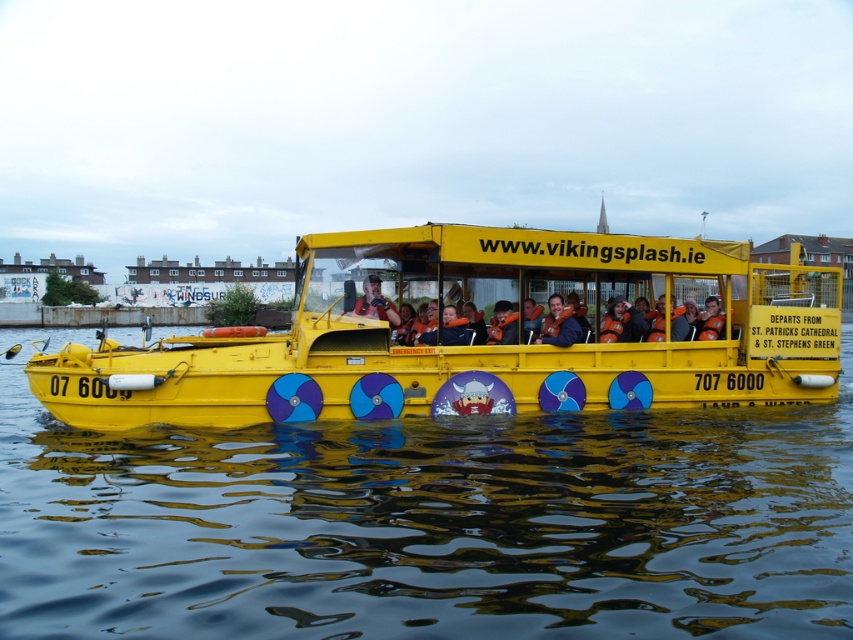
Is matte black helmet at center bigger than orange life vest at center?

Correct, matte black helmet at center is larger in size than orange life vest at center.

Is point (358, 307) positioned after point (494, 308)?

No, (358, 307) is in front of (494, 308).

Locate an element on the screen. Image resolution: width=853 pixels, height=640 pixels. matte black helmet at center is located at coordinates (375, 301).

Locate an element on the screen. The image size is (853, 640). matte black helmet at center is located at coordinates (375, 301).

Consider the image. Who is more distant from viewer, (618, 298) or (363, 301)?

Point (618, 298)

Measure the distance between point (688, 326) and camera.

Point (688, 326) is 13.51 meters away from camera.

Between point (375, 301) and point (390, 321), which one is positioned behind?

Positioned behind is point (390, 321).

The width and height of the screenshot is (853, 640). I want to click on matte orange life vest at center, so click(x=669, y=323).

Based on the photo, can you confirm if matte orange life vest at center is positioned above matte black life vest at center?

Indeed, matte orange life vest at center is positioned over matte black life vest at center.

In the scene shown: Does matte orange life vest at center appear under matte black life vest at center?

No.

Is point (695, 314) more distant than point (576, 337)?

That is True.

The height and width of the screenshot is (640, 853). In order to click on matte orange life vest at center in this screenshot , I will do `click(669, 323)`.